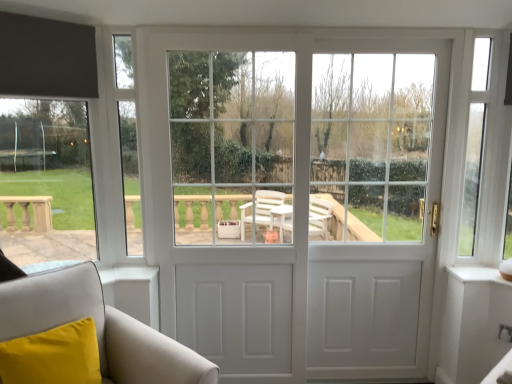
Where is `white leather armchair at lower left`? white leather armchair at lower left is located at coordinates (98, 327).

This screenshot has height=384, width=512. I want to click on white glossy door at right, which is the 1th screen door from right to left, so click(375, 208).

Describe the element at coordinates (375, 208) in the screenshot. I see `white glossy door at right, which ranks as the second screen door in left-to-right order` at that location.

Consider the image. What is the approximate width of white glossy door at center, positioned as the 1th screen door in left-to-right order?

white glossy door at center, positioned as the 1th screen door in left-to-right order, is 3.79 inches wide.

Locate an element on the screen. Image resolution: width=512 pixels, height=384 pixels. white glossy door at center, which is the second screen door in right-to-left order is located at coordinates (233, 205).

The height and width of the screenshot is (384, 512). What do you see at coordinates (485, 152) in the screenshot? I see `clear glass door at right` at bounding box center [485, 152].

Describe the element at coordinates (293, 198) in the screenshot. I see `white matte door at center` at that location.

The image size is (512, 384). In order to click on white leather armchair at lower left in this screenshot , I will do `click(98, 327)`.

Can you confirm if white glossy door at center, which is the second screen door in right-to-left order, is wider than white glossy door at right, which ranks as the second screen door in left-to-right order?

No, white glossy door at center, which is the second screen door in right-to-left order, is not wider than white glossy door at right, which ranks as the second screen door in left-to-right order.

Who is taller, white glossy door at center, positioned as the 1th screen door in left-to-right order, or white glossy door at right, which is the 1th screen door from right to left?

white glossy door at center, positioned as the 1th screen door in left-to-right order.

The image size is (512, 384). I want to click on screen door above the white glossy door at center, which is the second screen door in right-to-left order (from a real-world perspective), so click(375, 208).

Which object is more forward, white glossy door at center, positioned as the 1th screen door in left-to-right order, or white glossy door at right, which is the 1th screen door from right to left?

white glossy door at center, positioned as the 1th screen door in left-to-right order, is more forward.

Would you say white glossy door at center, which is the second screen door in right-to-left order, is inside or outside white leather armchair at lower left?

white glossy door at center, which is the second screen door in right-to-left order, is spatially situated outside white leather armchair at lower left.

From the image's perspective, which one is positioned lower, white glossy door at center, which is the second screen door in right-to-left order, or white leather armchair at lower left?

white leather armchair at lower left appears lower in the image.

Is white glossy door at center, which is the second screen door in right-to-left order, positioned with its back to white leather armchair at lower left?

No, white glossy door at center, which is the second screen door in right-to-left order,'s orientation is not away from white leather armchair at lower left.

Looking at this image, is the surface of white glossy door at center, positioned as the 1th screen door in left-to-right order, in direct contact with white leather armchair at lower left?

white glossy door at center, positioned as the 1th screen door in left-to-right order, and white leather armchair at lower left are not in contact.

Is white glossy door at right, which is the 1th screen door from right to left, oriented towards white leather armchair at lower left?

No, white glossy door at right, which is the 1th screen door from right to left, is not facing towards white leather armchair at lower left.

Which point is more distant from viewer, (314, 329) or (175, 353)?

Point (314, 329)

Does white glossy door at right, which is the 1th screen door from right to left, have a smaller size compared to white leather armchair at lower left?

Yes.

Which is more to the left, white glossy door at right, which is the 1th screen door from right to left, or white leather armchair at lower left?

white leather armchair at lower left.

How far apart are white glossy door at center, which is the second screen door in right-to-left order, and clear glass door at right?

white glossy door at center, which is the second screen door in right-to-left order, and clear glass door at right are 1.30 meters apart from each other.

Is point (180, 61) farther from camera compared to point (499, 63)?

Yes, it is behind point (499, 63).

Which of these two, white glossy door at center, which is the second screen door in right-to-left order, or clear glass door at right, is smaller?

A: Smaller between the two is clear glass door at right.

Is white glossy door at center, which is the second screen door in right-to-left order, not close to clear glass door at right?

That's right, there is a large distance between white glossy door at center, which is the second screen door in right-to-left order, and clear glass door at right.

Between white matte door at center and white glossy door at right, which ranks as the second screen door in left-to-right order, which one has more height?

white matte door at center is taller.

Is white matte door at center next to white glossy door at right, which ranks as the second screen door in left-to-right order?

white matte door at center is not next to white glossy door at right, which ranks as the second screen door in left-to-right order, and they're not touching.

The height and width of the screenshot is (384, 512). I want to click on door located above the white glossy door at right, which ranks as the second screen door in left-to-right order (from a real-world perspective), so tap(293, 198).

Can we say white matte door at center lies outside white glossy door at right, which ranks as the second screen door in left-to-right order?

No, most part of white matte door at center lies within white glossy door at right, which ranks as the second screen door in left-to-right order.

Is white leather armchair at lower left not inside clear glass door at right?

white leather armchair at lower left is positioned outside clear glass door at right.

Can you confirm if white leather armchair at lower left is taller than clear glass door at right?

In fact, white leather armchair at lower left may be shorter than clear glass door at right.

How far apart are white leather armchair at lower left and clear glass door at right?

white leather armchair at lower left and clear glass door at right are 6.71 feet apart.

Is white leather armchair at lower left positioned behind clear glass door at right?

No, white leather armchair at lower left is closer to the camera.

From their relative heights in the image, would you say white leather armchair at lower left is taller or shorter than white glossy door at center, positioned as the 1th screen door in left-to-right order?

Considering their sizes, white leather armchair at lower left has less height than white glossy door at center, positioned as the 1th screen door in left-to-right order.

Considering the relative sizes of white leather armchair at lower left and white glossy door at center, which is the second screen door in right-to-left order, in the image provided, is white leather armchair at lower left thinner than white glossy door at center, which is the second screen door in right-to-left order,?

In fact, white leather armchair at lower left might be wider than white glossy door at center, which is the second screen door in right-to-left order.

This screenshot has height=384, width=512. I want to click on screen door below the white glossy door at right, which is the 1th screen door from right to left (from the image's perspective), so coord(233,205).

The image size is (512, 384). Find the location of `furniture that appears on the left of white glossy door at center, positioned as the 1th screen door in left-to-right order`. furniture that appears on the left of white glossy door at center, positioned as the 1th screen door in left-to-right order is located at coordinates (98, 327).

Based on the photo, from the image, which object appears to be farther from white glossy door at right, which ranks as the second screen door in left-to-right order, white matte door at center or clear glass door at right?

clear glass door at right is further to white glossy door at right, which ranks as the second screen door in left-to-right order.

From the image, which object appears to be nearer to white leather armchair at lower left, white matte door at center or white glossy door at center, which is the second screen door in right-to-left order?

Based on the image, white glossy door at center, which is the second screen door in right-to-left order, appears to be nearer to white leather armchair at lower left.

From the image, which object appears to be farther from white glossy door at center, positioned as the 1th screen door in left-to-right order, white leather armchair at lower left or white glossy door at right, which ranks as the second screen door in left-to-right order?

The object further to white glossy door at center, positioned as the 1th screen door in left-to-right order, is white leather armchair at lower left.

When comparing their distances from white glossy door at right, which is the 1th screen door from right to left, does white matte door at center or white leather armchair at lower left seem further?

white leather armchair at lower left is further to white glossy door at right, which is the 1th screen door from right to left.

From the image, which object appears to be farther from clear glass door at right, white glossy door at center, positioned as the 1th screen door in left-to-right order, or white matte door at center?

Based on the image, white glossy door at center, positioned as the 1th screen door in left-to-right order, appears to be further to clear glass door at right.

From the image, which object appears to be nearer to white glossy door at right, which ranks as the second screen door in left-to-right order, white glossy door at center, which is the second screen door in right-to-left order, or white matte door at center?

white matte door at center is closer to white glossy door at right, which ranks as the second screen door in left-to-right order.

Based on their spatial positions, is clear glass door at right or white matte door at center closer to white glossy door at right, which ranks as the second screen door in left-to-right order?

white matte door at center lies closer to white glossy door at right, which ranks as the second screen door in left-to-right order, than the other object.

Considering their positions, is white glossy door at center, which is the second screen door in right-to-left order, positioned closer to white matte door at center than white glossy door at right, which is the 1th screen door from right to left?

Among the two, white glossy door at center, which is the second screen door in right-to-left order, is located nearer to white matte door at center.

I want to click on door between white leather armchair at lower left and white glossy door at right, which is the 1th screen door from right to left, so click(293, 198).

In order to click on screen door situated between white leather armchair at lower left and white glossy door at right, which is the 1th screen door from right to left, from left to right in this screenshot , I will do `click(233, 205)`.

Identify the location of door between white leather armchair at lower left and clear glass door at right. (293, 198).

This screenshot has height=384, width=512. Find the location of `door between white glossy door at center, which is the second screen door in right-to-left order, and clear glass door at right`. door between white glossy door at center, which is the second screen door in right-to-left order, and clear glass door at right is located at coordinates (293, 198).